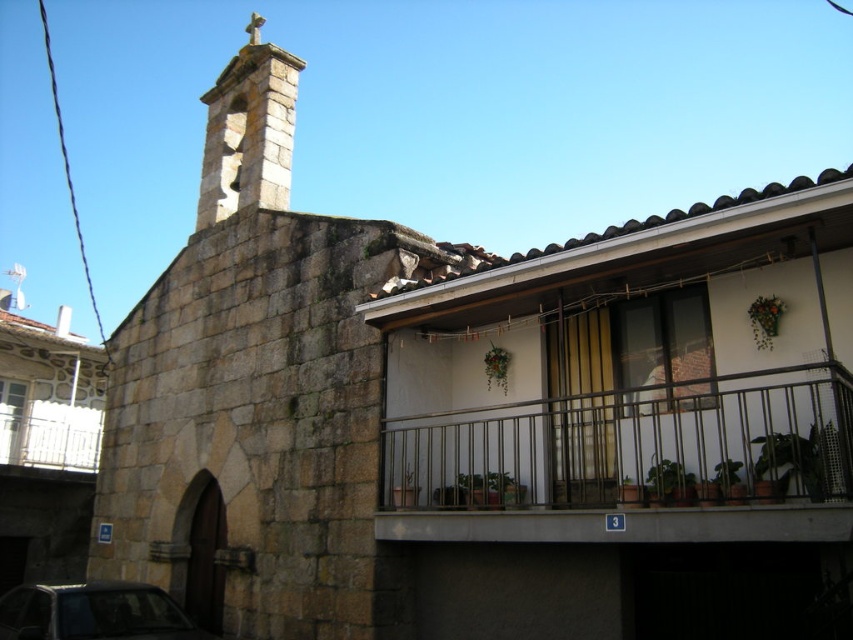
Is shiny black car at lower left to the left of white metal balcony at upper left from the viewer's perspective?

No, shiny black car at lower left is not to the left of white metal balcony at upper left.

Is point (59, 604) positioned in front of point (42, 406)?

Yes, it is.

Looking at this image, who is more distant from viewer, (86, 600) or (86, 468)?

Positioned behind is point (86, 468).

You are a GUI agent. You are given a task and a screenshot of the screen. Output one action in this format:
    pyautogui.click(x=<x>, y=<y>)
    Task: Click on the shiny black car at lower left
    Image resolution: width=853 pixels, height=640 pixels.
    Given the screenshot: What is the action you would take?
    pyautogui.click(x=93, y=612)

Is point (844, 492) less distant than point (97, 460)?

Yes.

Can you confirm if metallic railing at center is positioned below white metal balcony at upper left?

Incorrect, metallic railing at center is not positioned below white metal balcony at upper left.

Does point (589, 476) come farther from viewer compared to point (79, 470)?

That is False.

At what (x,y) coordinates should I click in order to perform the action: click on metallic railing at center. Please return your answer as a coordinate pair (x, y). Looking at the image, I should click on (631, 465).

Can you confirm if metallic railing at center is shorter than shiny black car at lower left?

Incorrect, metallic railing at center's height does not fall short of shiny black car at lower left's.

Is point (555, 515) positioned before point (56, 588)?

Yes, point (555, 515) is closer to viewer.

Identify the location of metallic railing at center. (631, 465).